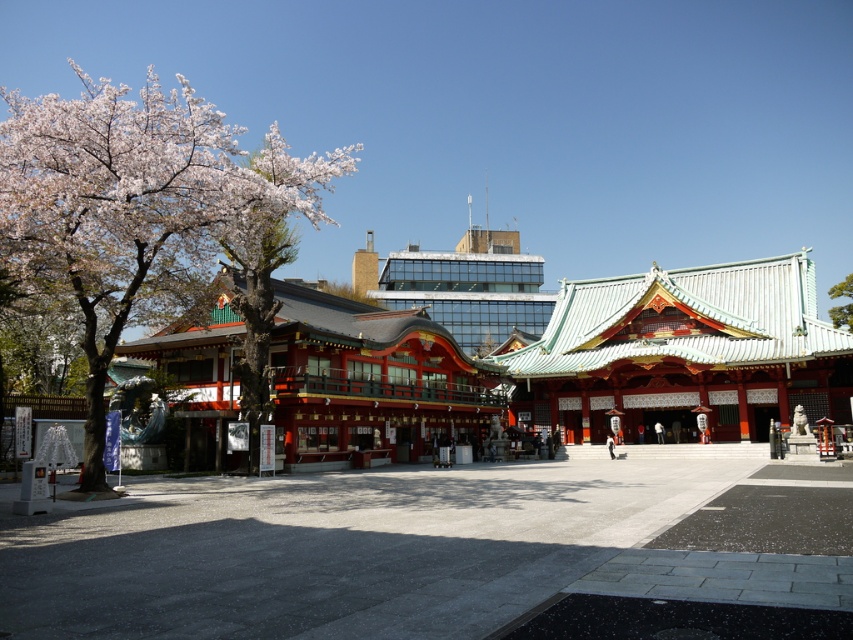
Question: Observing the image, what is the correct spatial positioning of smooth bark tree at left in reference to green leafy tree at upper center?

Choices:
 (A) below
 (B) above

Answer: (B)

Question: Is smooth bark tree at left thinner than green leafy tree at upper center?

Choices:
 (A) no
 (B) yes

Answer: (B)

Question: Which of the following is the farthest from the observer?

Choices:
 (A) (219, 216)
 (B) (828, 314)

Answer: (B)

Question: Is smooth bark tree at left positioned before green leafy tree at upper center?

Choices:
 (A) yes
 (B) no

Answer: (A)